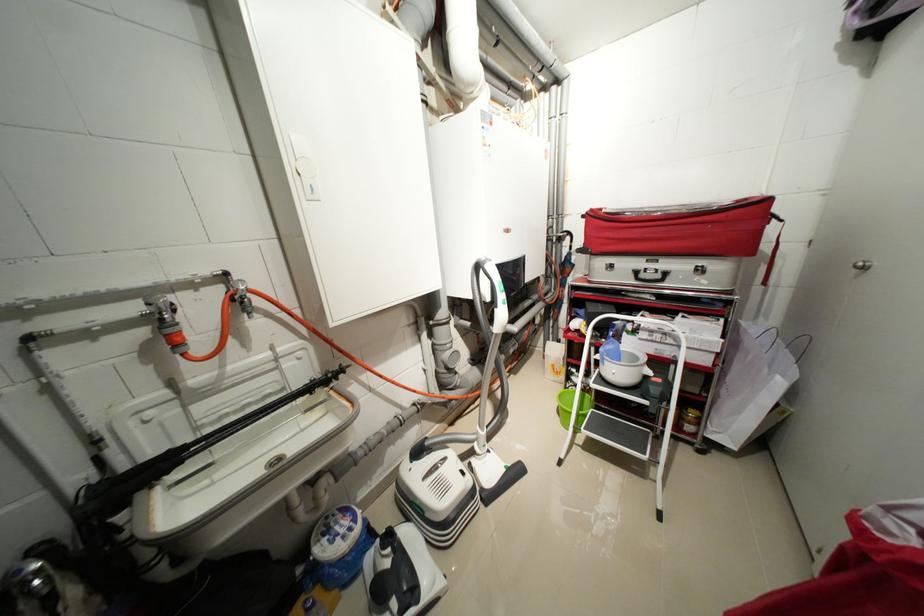
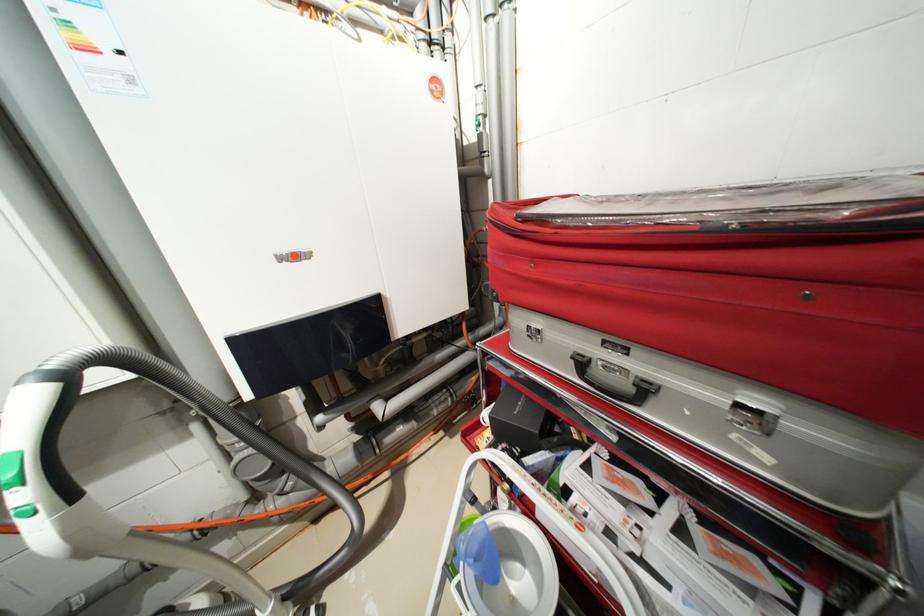
Where in the second image is the point corresponding to pixel 643 274 from the first image?

(589, 363)